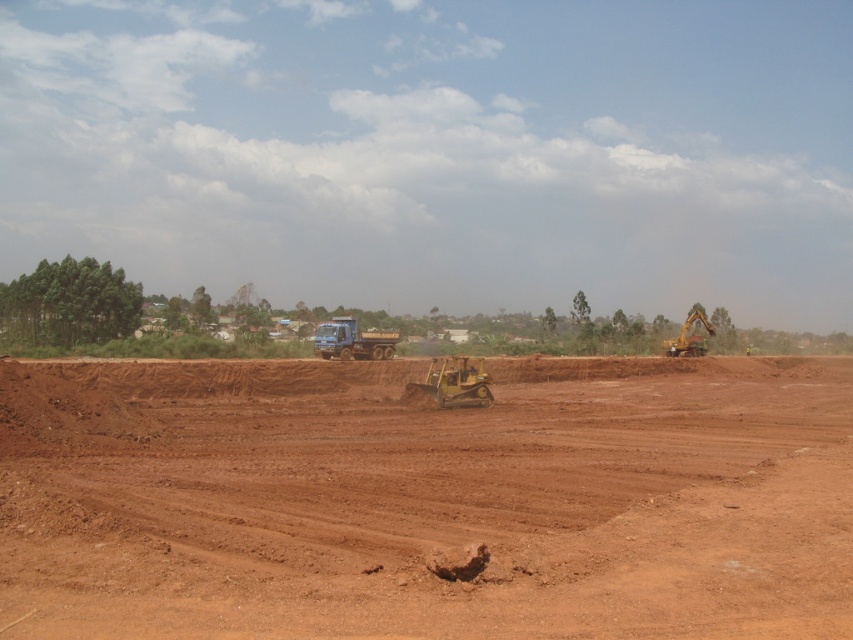
Does brown dirt field at center have a larger size compared to yellow metallic excavator at right?

Yes.

Between brown dirt field at center and yellow metallic excavator at right, which one appears on the right side from the viewer's perspective?

yellow metallic excavator at right

You are a GUI agent. You are given a task and a screenshot of the screen. Output one action in this format:
    pyautogui.click(x=<x>, y=<y>)
    Task: Click on the brown dirt field at center
    This screenshot has height=640, width=853.
    Given the screenshot: What is the action you would take?
    pyautogui.click(x=426, y=499)

Can you confirm if brown dirt field at center is taller than yellow rubber tracked vehicle at center?

Indeed, brown dirt field at center has a greater height compared to yellow rubber tracked vehicle at center.

Is brown dirt field at center smaller than yellow rubber tracked vehicle at center?

Incorrect, brown dirt field at center is not smaller in size than yellow rubber tracked vehicle at center.

Measure the distance between brown dirt field at center and camera.

brown dirt field at center and camera are 6.20 meters apart.

Image resolution: width=853 pixels, height=640 pixels. In order to click on brown dirt field at center in this screenshot , I will do `click(426, 499)`.

Is the position of yellow rubber tracked vehicle at center more distant than that of yellow metallic excavator at right?

No, yellow rubber tracked vehicle at center is in front of yellow metallic excavator at right.

Can you confirm if yellow rubber tracked vehicle at center is taller than yellow metallic excavator at right?

In fact, yellow rubber tracked vehicle at center may be shorter than yellow metallic excavator at right.

What do you see at coordinates (451, 381) in the screenshot? I see `yellow rubber tracked vehicle at center` at bounding box center [451, 381].

Locate an element on the screen. yellow rubber tracked vehicle at center is located at coordinates (451, 381).